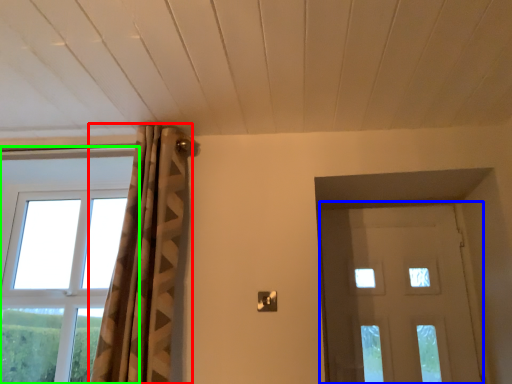
Question: Considering the real-world distances, which object is farthest from curtain (highlighted by a red box)? door (highlighted by a blue box) or window (highlighted by a green box)?

Choices:
 (A) door
 (B) window

Answer: (A)